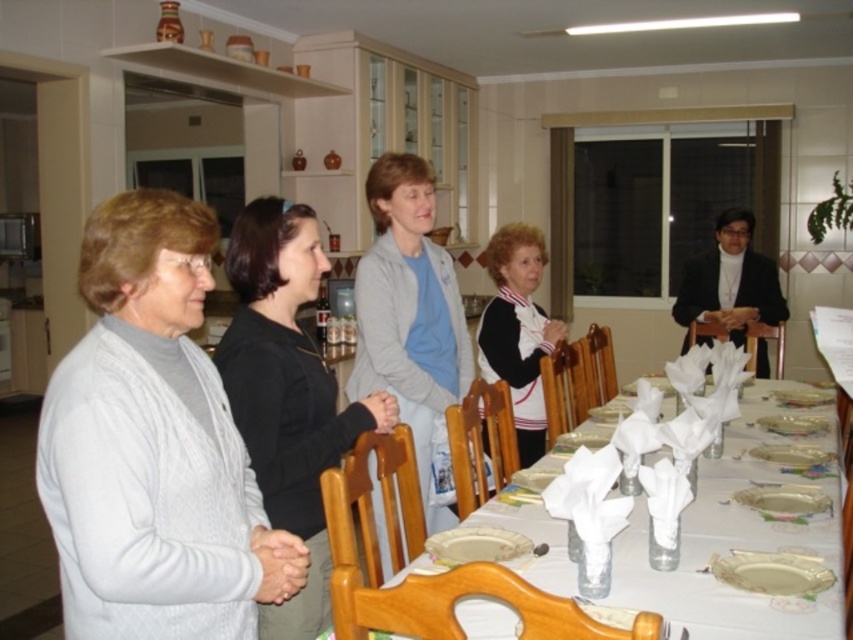
Does white paper napkin at center have a greater width compared to light blue sweater at center?

Yes.

Between point (724, 512) and point (437, 276), which one is positioned behind?

Point (437, 276)

Who is more forward, (711, 588) or (422, 490)?

Positioned in front is point (711, 588).

Where is `white paper napkin at center`? white paper napkin at center is located at coordinates pos(733,547).

Between point (665, 604) and point (270, 205), which one is positioned in front?

Positioned in front is point (665, 604).

At what (x,y) coordinates should I click in order to perform the action: click on white paper napkin at center. Please return your answer as a coordinate pair (x, y). Looking at the image, I should click on [x=733, y=547].

Identify the location of white paper napkin at center. (733, 547).

Between white knitted sweater at left and black matte sweater at center, which one has less height?

white knitted sweater at left

Can you confirm if white knitted sweater at left is smaller than black matte sweater at center?

Correct, white knitted sweater at left occupies less space than black matte sweater at center.

Locate an element on the screen. The height and width of the screenshot is (640, 853). white knitted sweater at left is located at coordinates (154, 445).